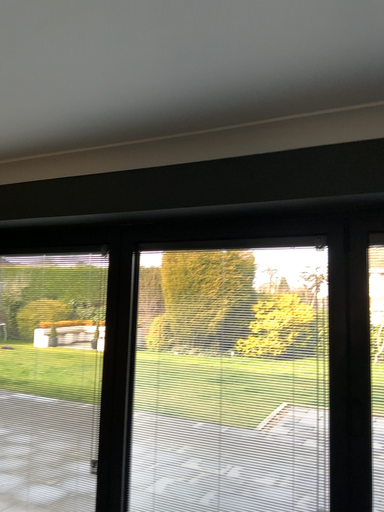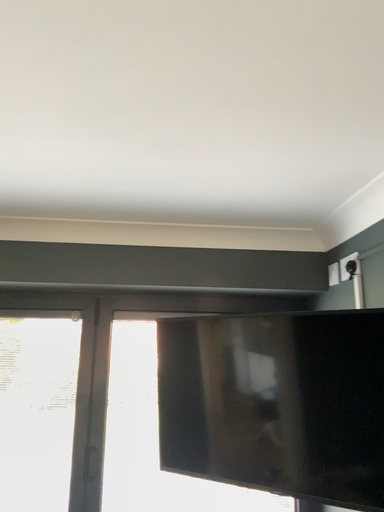
Question: Which way did the camera rotate in the video?

Choices:
 (A) rotated left
 (B) rotated right

Answer: (B)